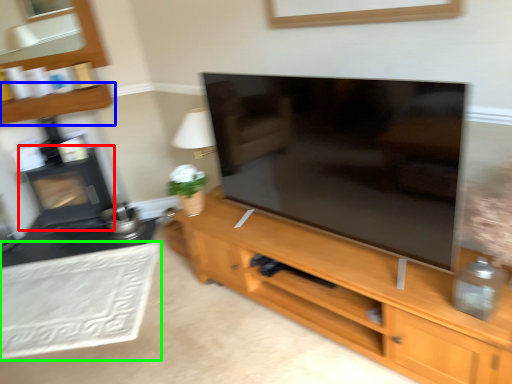
Question: Which object is the farthest from fireplace (highlighted by a red box)? Choose among these: shelf (highlighted by a blue box) or plain (highlighted by a green box).

Choices:
 (A) shelf
 (B) plain

Answer: (B)